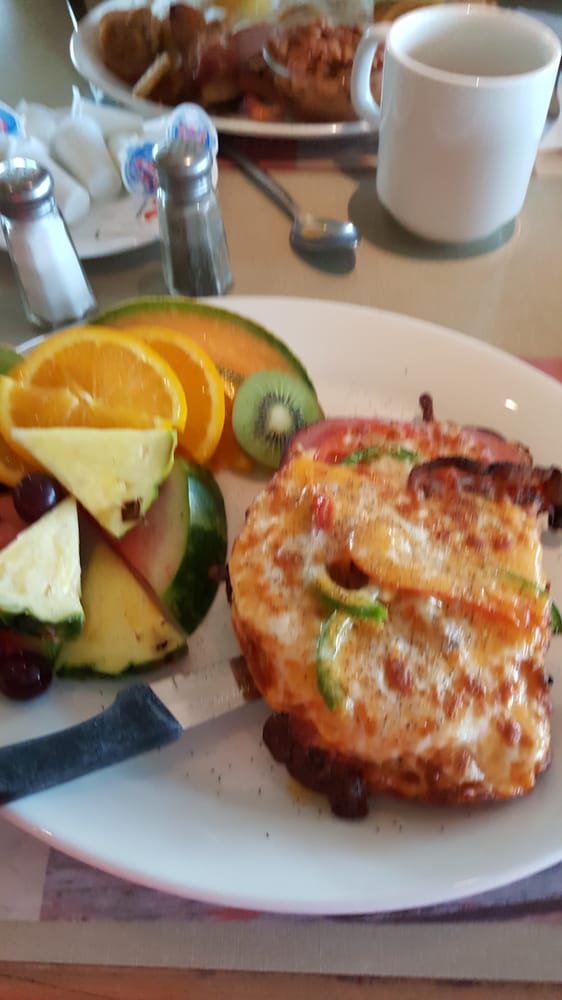
This screenshot has height=1000, width=562. In order to click on spoon in this screenshot , I will do (323, 230).